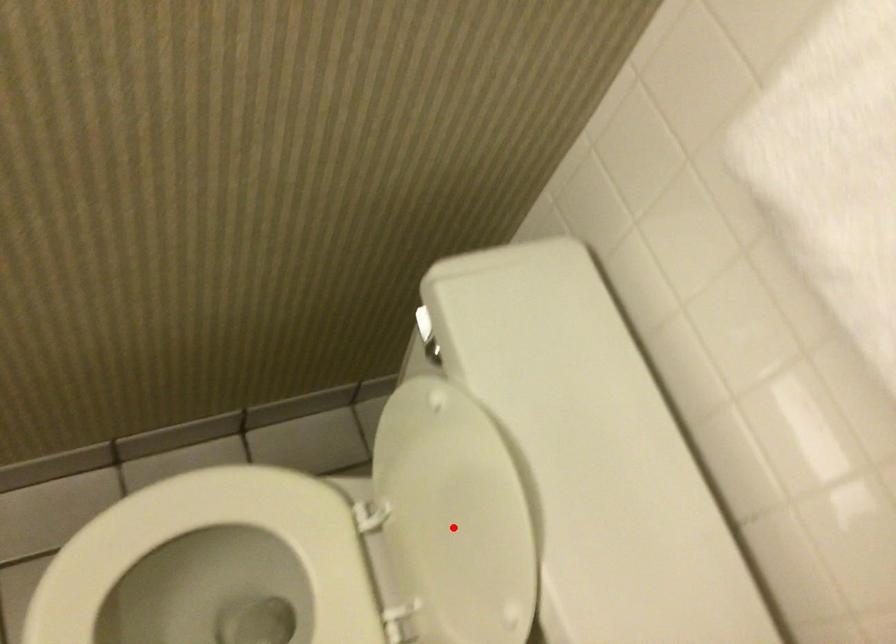
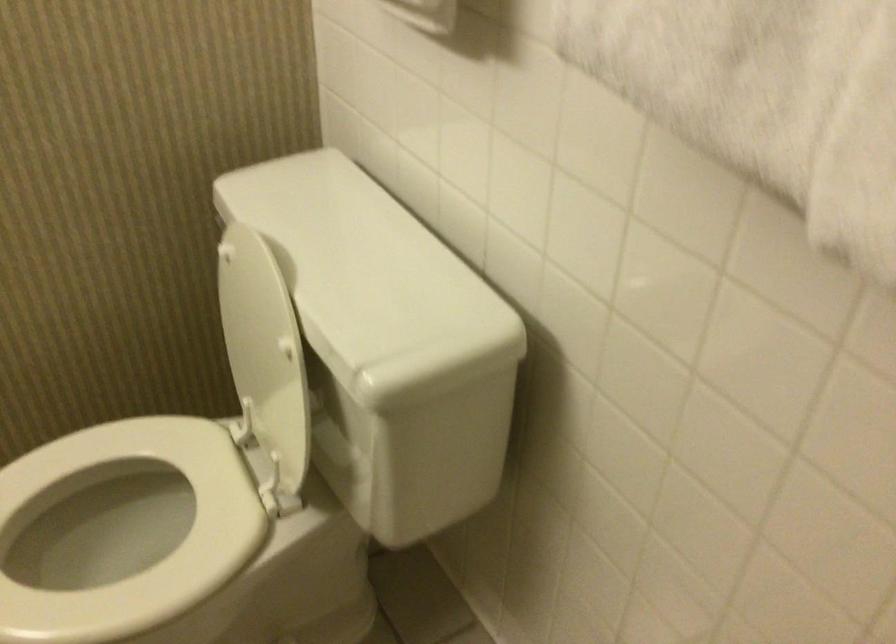
Question: I am providing you with two images of the same scene from different viewpoints. In image1, a red point is highlighted. Considering the same 3D point in image2, which of the following is correct?

Choices:
 (A) It is closer
 (B) It is farther

Answer: (B)